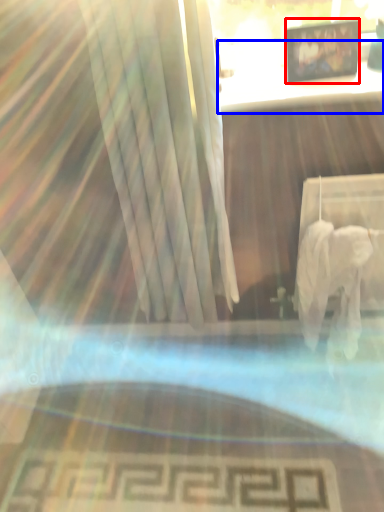
Question: Which of the following is the farthest to the observer, picture frame (highlighted by a red box) or table (highlighted by a blue box)?

Choices:
 (A) picture frame
 (B) table

Answer: (A)